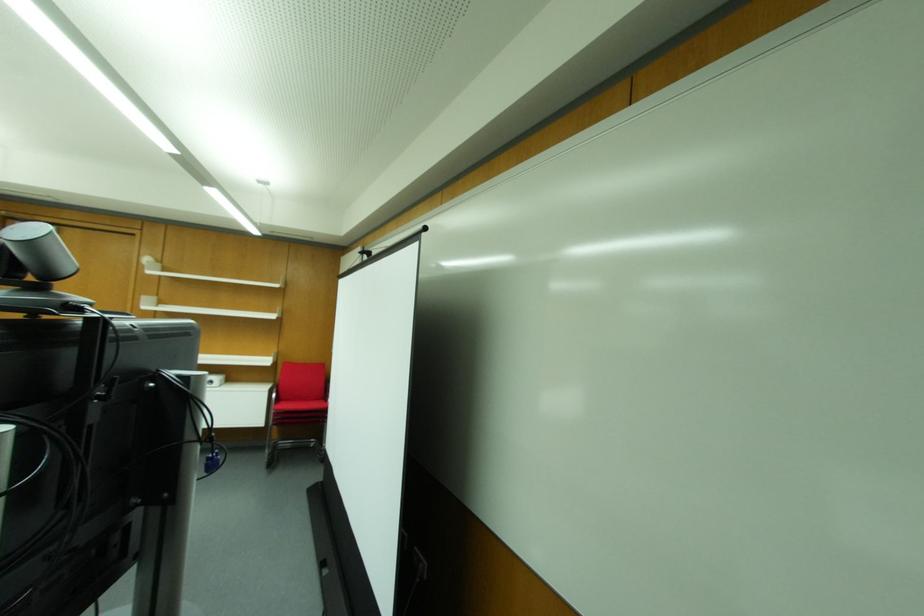
This screenshot has height=616, width=924. In order to click on metal chair armrest in this screenshot , I will do `click(276, 392)`.